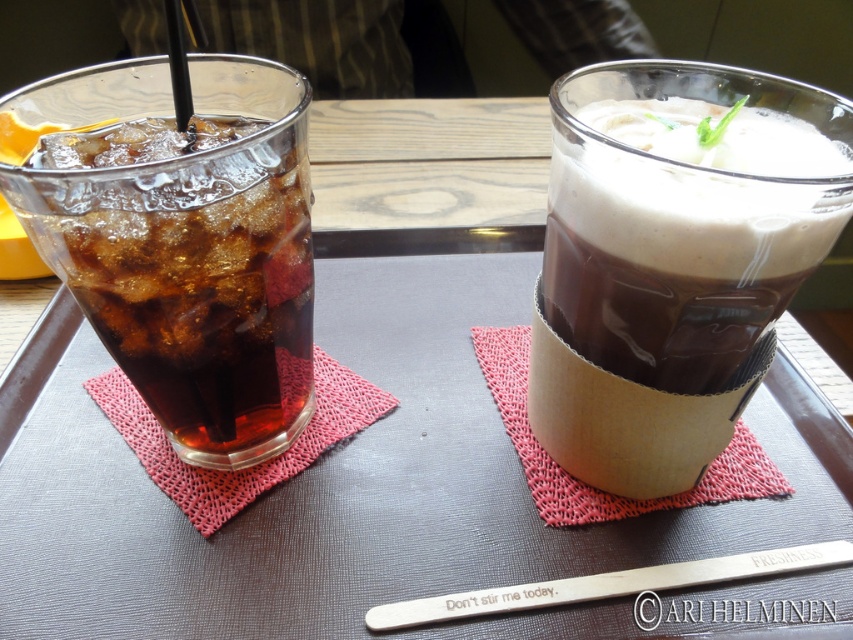
Between point (583, 451) and point (241, 253), which one is positioned behind?

The point (583, 451) is behind.

Does smooth chocolate milkshake at center have a lesser width compared to translucent glass at left?

No, smooth chocolate milkshake at center is not thinner than translucent glass at left.

Does point (614, 396) lie behind point (260, 364)?

No, (614, 396) is in front of (260, 364).

Identify the location of smooth chocolate milkshake at center. The height and width of the screenshot is (640, 853). (666, 276).